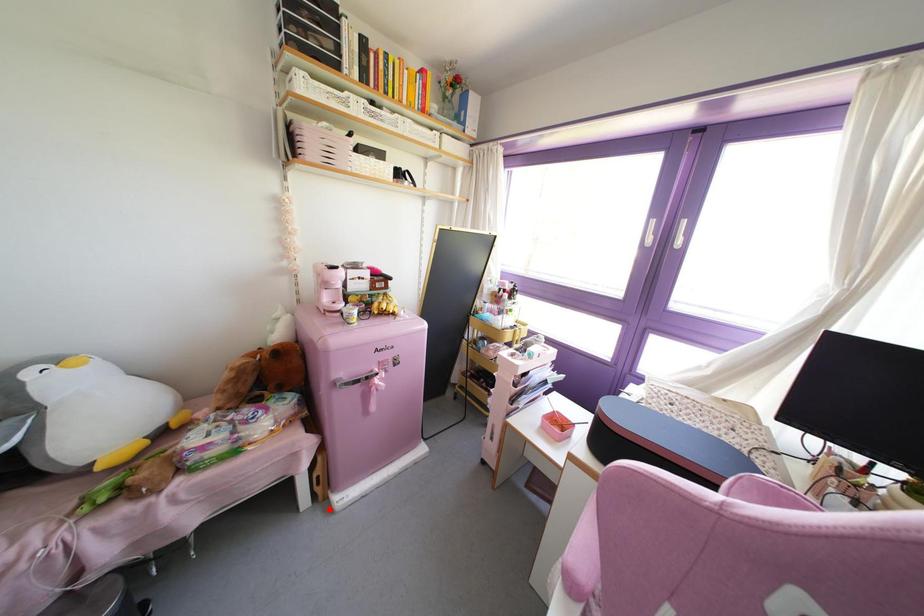
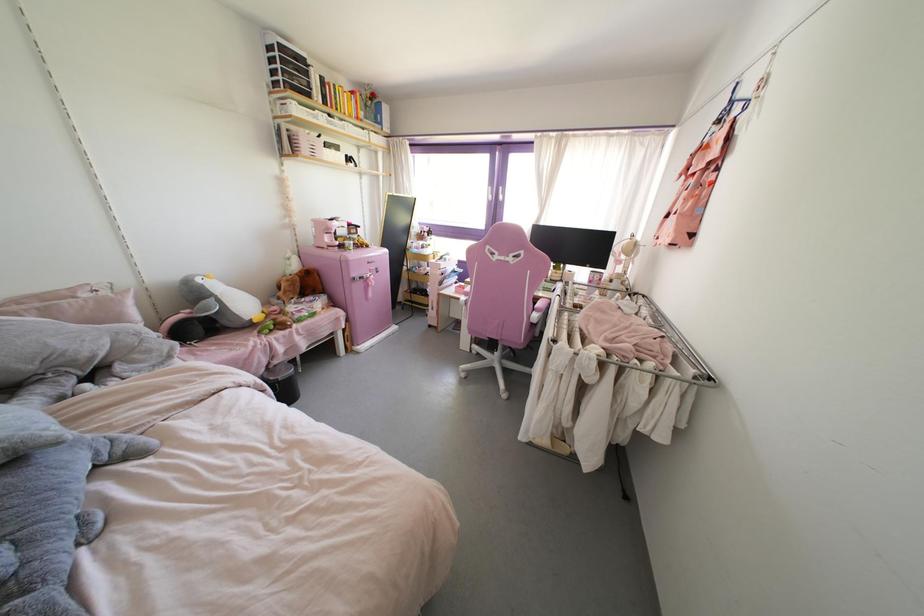
Question: A red point is marked in image1. In image2, is the corresponding 3D point closer to the camera or farther? Reply with the corresponding letter.

Choices:
 (A) The corresponding 3D point is closer.
 (B) The corresponding 3D point is farther.

Answer: (A)